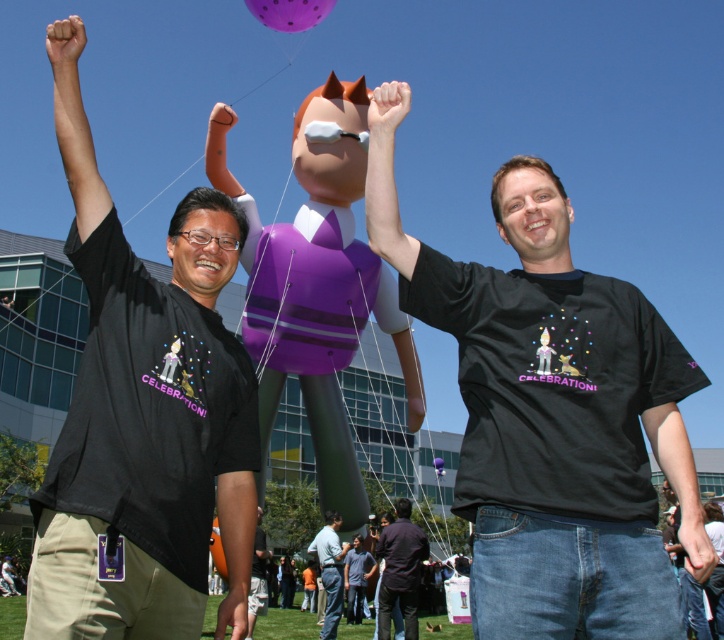
From the picture: Is black matte t-shirt at center to the left of dark brown shirt at center from the viewer's perspective?

In fact, black matte t-shirt at center is to the right of dark brown shirt at center.

Who is more distant from viewer, (x=397, y=282) or (x=420, y=534)?

The point (x=420, y=534) is more distant.

Describe the element at coordinates (550, 412) in the screenshot. I see `black matte t-shirt at center` at that location.

The width and height of the screenshot is (724, 640). What are the coordinates of `black matte t-shirt at center` in the screenshot? It's located at (550, 412).

Is black matte t-shirt at center positioned before black matte t-shirt at left?

That is False.

Is black matte t-shirt at center thinner than black matte t-shirt at left?

In fact, black matte t-shirt at center might be wider than black matte t-shirt at left.

Is point (437, 324) farther from viewer compared to point (117, 372)?

That is True.

I want to click on black matte t-shirt at center, so 550,412.

Between dark gray shirt at center and dark gray cotton shirt at center, which one has less height?

With less height is dark gray shirt at center.

Does point (324, 616) come farther from viewer compared to point (345, 573)?

No, (324, 616) is closer to viewer.

This screenshot has width=724, height=640. Describe the element at coordinates (329, 570) in the screenshot. I see `dark gray shirt at center` at that location.

Where is `dark gray shirt at center`? This screenshot has width=724, height=640. dark gray shirt at center is located at coordinates (329, 570).